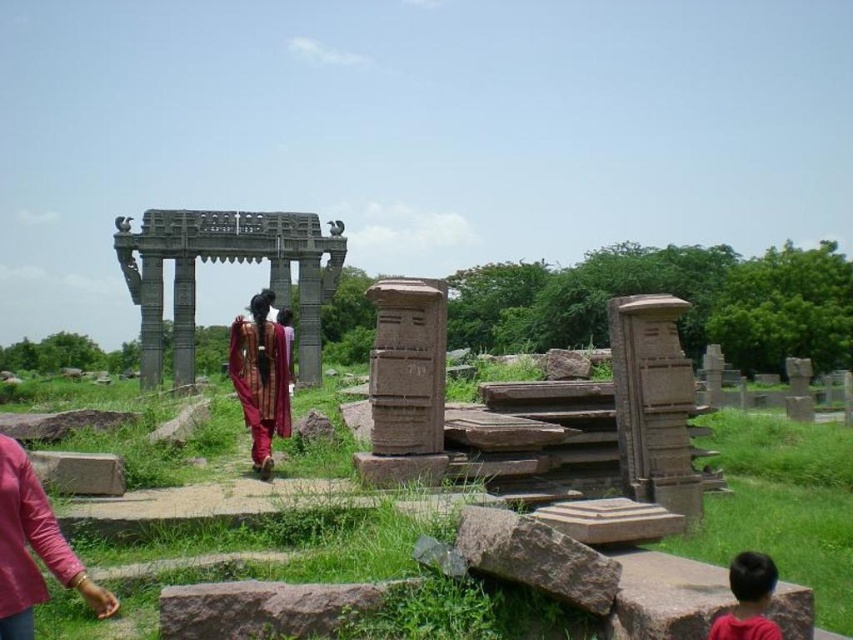
Is matte red robe at lower left above dark brown hair at lower right?

Yes, matte red robe at lower left is above dark brown hair at lower right.

What are the coordinates of `matte red robe at lower left` in the screenshot? It's located at (26, 544).

Where is `matte red robe at lower left`? The width and height of the screenshot is (853, 640). matte red robe at lower left is located at coordinates (26, 544).

Between point (54, 556) and point (277, 330), which one is positioned in front?

Positioned in front is point (54, 556).

Who is lower down, matte red robe at lower left or maroon silk robe at center?

matte red robe at lower left

What do you see at coordinates (26, 544) in the screenshot? Image resolution: width=853 pixels, height=640 pixels. I see `matte red robe at lower left` at bounding box center [26, 544].

Where is `matte red robe at lower left`? Image resolution: width=853 pixels, height=640 pixels. matte red robe at lower left is located at coordinates (26, 544).

Is green grass at center taller than maroon silk robe at center?

Indeed, green grass at center has a greater height compared to maroon silk robe at center.

Does point (193, 474) come in front of point (288, 420)?

Yes, point (193, 474) is closer to viewer.

Locate an element on the screen. The height and width of the screenshot is (640, 853). green grass at center is located at coordinates (781, 502).

Find the location of a particular element. green grass at center is located at coordinates (781, 502).